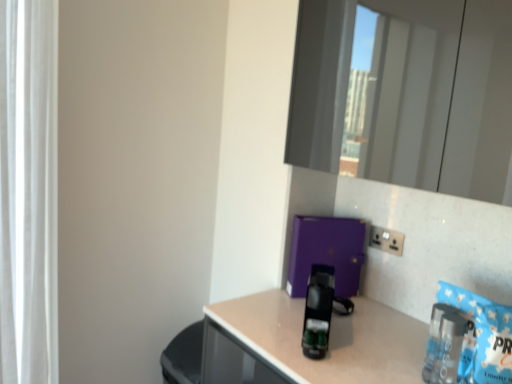
Question: Are black plastic coffee machine at center and white sheer curtain at left making contact?

Choices:
 (A) no
 (B) yes

Answer: (A)

Question: Is black plastic coffee machine at center not close to white sheer curtain at left?

Choices:
 (A) no
 (B) yes

Answer: (B)

Question: Can you confirm if black plastic coffee machine at center is smaller than white sheer curtain at left?

Choices:
 (A) no
 (B) yes

Answer: (B)

Question: Does black plastic coffee machine at center come behind white sheer curtain at left?

Choices:
 (A) yes
 (B) no

Answer: (B)

Question: Is white sheer curtain at left inside black plastic coffee machine at center?

Choices:
 (A) no
 (B) yes

Answer: (A)

Question: From the image's perspective, is black plastic coffee machine at center over white sheer curtain at left?

Choices:
 (A) yes
 (B) no

Answer: (B)

Question: Does clear plastic bottle at lower right lie behind white sheer curtain at left?

Choices:
 (A) no
 (B) yes

Answer: (A)

Question: Does clear plastic bottle at lower right have a greater height compared to white sheer curtain at left?

Choices:
 (A) yes
 (B) no

Answer: (B)

Question: Considering the relative sizes of clear plastic bottle at lower right and white sheer curtain at left in the image provided, is clear plastic bottle at lower right smaller than white sheer curtain at left?

Choices:
 (A) yes
 (B) no

Answer: (A)

Question: From a real-world perspective, is clear plastic bottle at lower right located beneath white sheer curtain at left?

Choices:
 (A) no
 (B) yes

Answer: (B)

Question: Is clear plastic bottle at lower right aimed at white sheer curtain at left?

Choices:
 (A) yes
 (B) no

Answer: (B)

Question: From a real-world perspective, does clear plastic bottle at lower right stand above white sheer curtain at left?

Choices:
 (A) yes
 (B) no

Answer: (B)

Question: Is white sheer curtain at left placed right next to black plastic coffee machine at center?

Choices:
 (A) no
 (B) yes

Answer: (A)